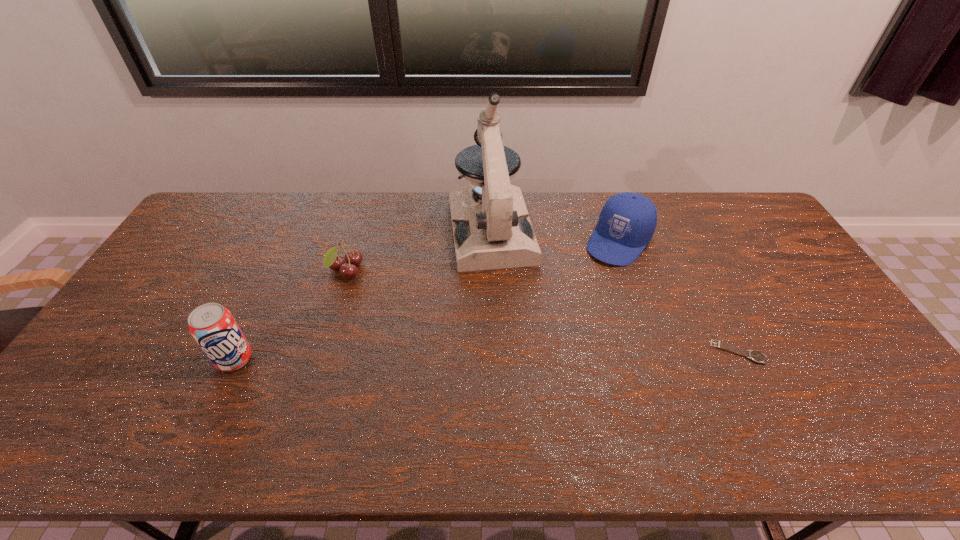
Identify the location of free spot between the fourth tallest object and the third object from right to left. The image size is (960, 540). (419, 251).

I want to click on vacant area between the cherry and the soda can, so click(290, 315).

Where is `free area in between the microscope and the leftmost object`? free area in between the microscope and the leftmost object is located at coordinates (363, 295).

I want to click on free space between the fourth object from left to right and the shortest object, so click(x=679, y=296).

This screenshot has height=540, width=960. I want to click on vacant point located between the soda can and the second object from right to left, so click(427, 300).

Identify the location of free space between the soda can and the fourth object from right to left. click(x=290, y=315).

I want to click on free spot between the soda can and the watch, so click(x=487, y=356).

Locate an element on the screen. This screenshot has width=960, height=540. blank region between the shortest object and the cap is located at coordinates (679, 296).

Where is `free point between the microscope and the second shortest object`? The image size is (960, 540). free point between the microscope and the second shortest object is located at coordinates (419, 251).

Identify which object is located as the third nearest to the cap. Please provide its 2D coordinates. Your answer should be formatted as a tuple, i.e. [(x, y)], where the tuple contains the x and y coordinates of a point satisfying the conditions above.

[(353, 257)]